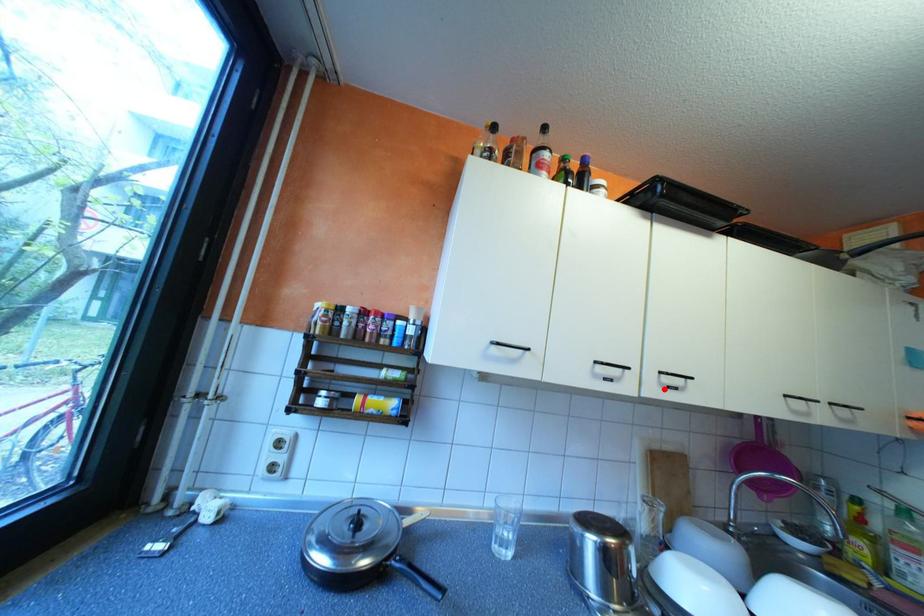
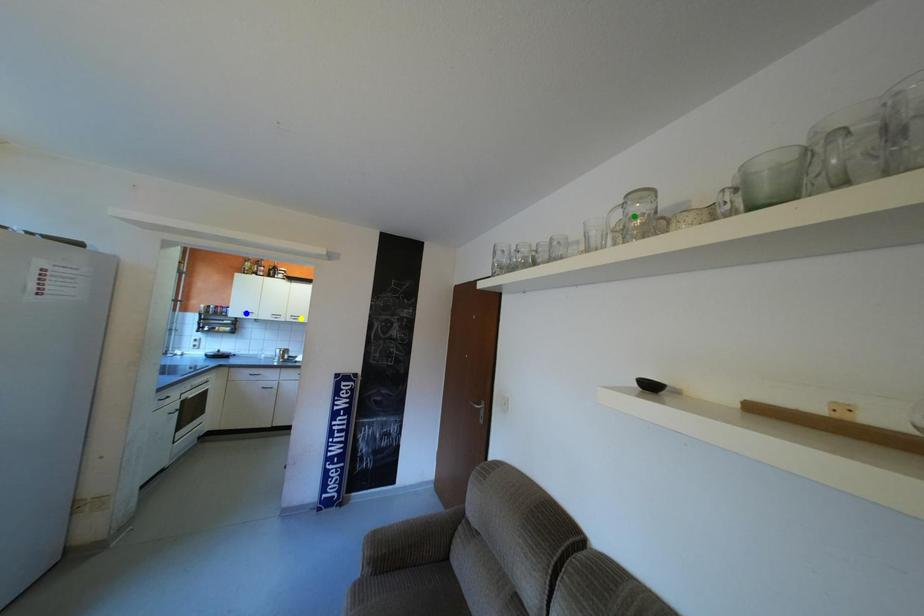
Question: I am providing you with two images of the same scene from different viewpoints. A red point is marked on the first image. You are given multiple points on the second image. Which mark in image 2 goes with the point in image 1?

Choices:
 (A) green point
 (B) blue point
 (C) yellow point

Answer: (C)